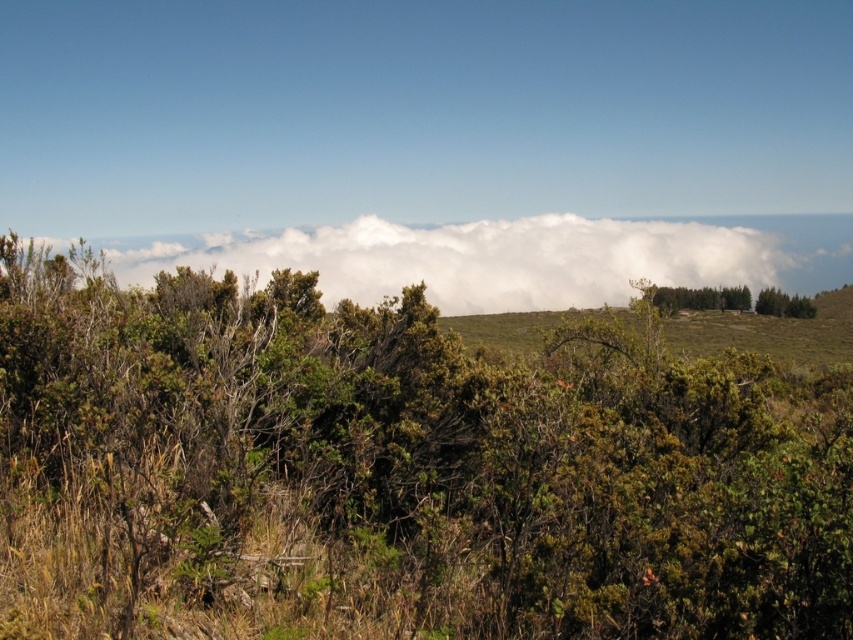
Question: Is green leafy bush at center further to the viewer compared to green leafy tree at center?

Choices:
 (A) yes
 (B) no

Answer: (B)

Question: Which point is farther to the camera?

Choices:
 (A) green leafy tree at center
 (B) white fluffy cloud at upper center
 (C) green leafy bush at center

Answer: (A)

Question: Is white fluffy cloud at upper center above green leafy tree at center?

Choices:
 (A) yes
 (B) no

Answer: (A)

Question: Which object is closer to the camera taking this photo?

Choices:
 (A) green leafy tree at center
 (B) white fluffy cloud at upper center
 (C) green leafy bush at center

Answer: (C)

Question: Is green leafy bush at center thinner than white fluffy cloud at upper center?

Choices:
 (A) yes
 (B) no

Answer: (A)

Question: Which object is positioned farthest from the green leafy bush at center?

Choices:
 (A) white fluffy cloud at upper center
 (B) green leafy tree at center

Answer: (A)